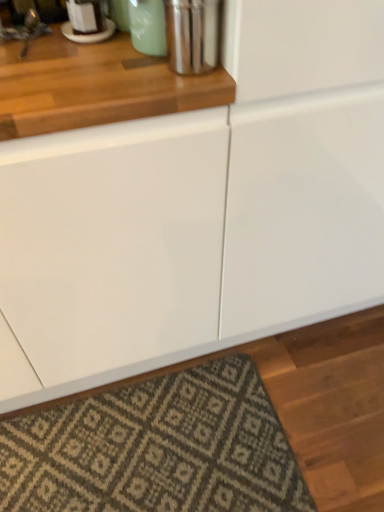
Identify the location of free location above textured beige rug at lower center (from a real-world perspective). This screenshot has height=512, width=384. (146, 444).